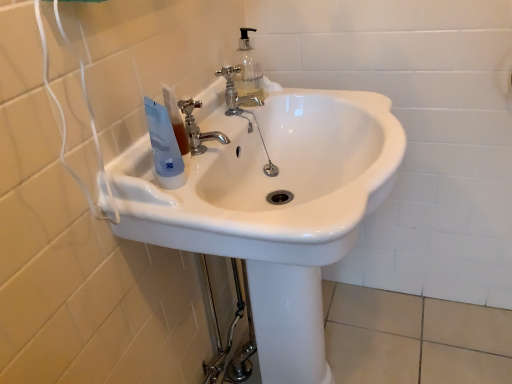
Question: In terms of width, does white plastic bottle at upper left look wider or thinner when compared to blue plastic tube at upper left?

Choices:
 (A) wide
 (B) thin

Answer: (B)

Question: From the image's perspective, is white plastic bottle at upper left above or below blue plastic tube at upper left?

Choices:
 (A) above
 (B) below

Answer: (A)

Question: Estimate the real-world distances between objects in this image. Which object is closer to the white plastic bottle at upper left?

Choices:
 (A) chrome metallic faucet at upper center, positioned as the 2th tap in front-to-back order
 (B) blue plastic tube at upper left
 (C) white glossy sink at center
 (D) chrome metallic faucet at center, which ranks as the first tap in left-to-right order

Answer: (B)

Question: Which of these objects is positioned closest to the white plastic bottle at upper left?

Choices:
 (A) chrome metallic faucet at center, acting as the second tap starting from the right
 (B) chrome metallic faucet at upper center, which appears as the 1th tap when viewed from the back
 (C) white glossy sink at center
 (D) blue plastic tube at upper left

Answer: (D)